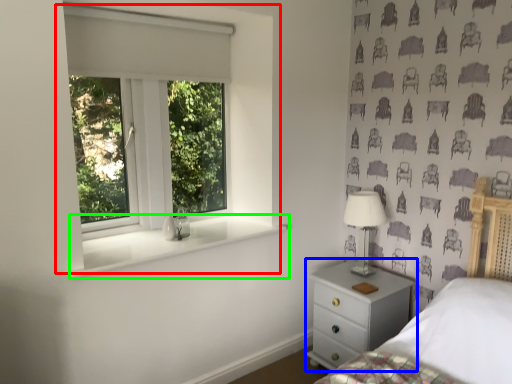
Question: Which object is positioned farthest from window (highlighted by a red box)? Select from chest of drawers (highlighted by a blue box) and window sill (highlighted by a green box).

Choices:
 (A) chest of drawers
 (B) window sill

Answer: (A)